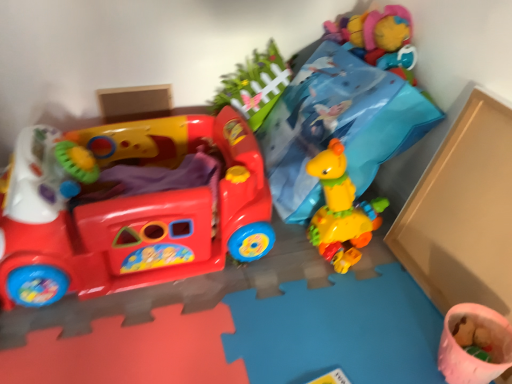
Locate an element on the screen. Image resolution: width=512 pixels, height=384 pixels. vacant space behind pink fabric cup at lower right, the 1th toy viewed from the right is located at coordinates (410, 299).